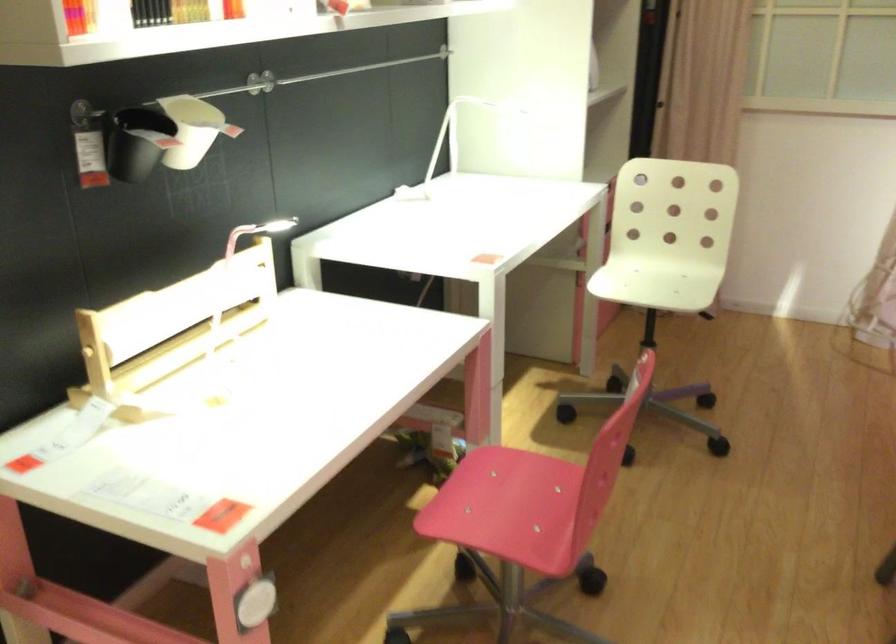
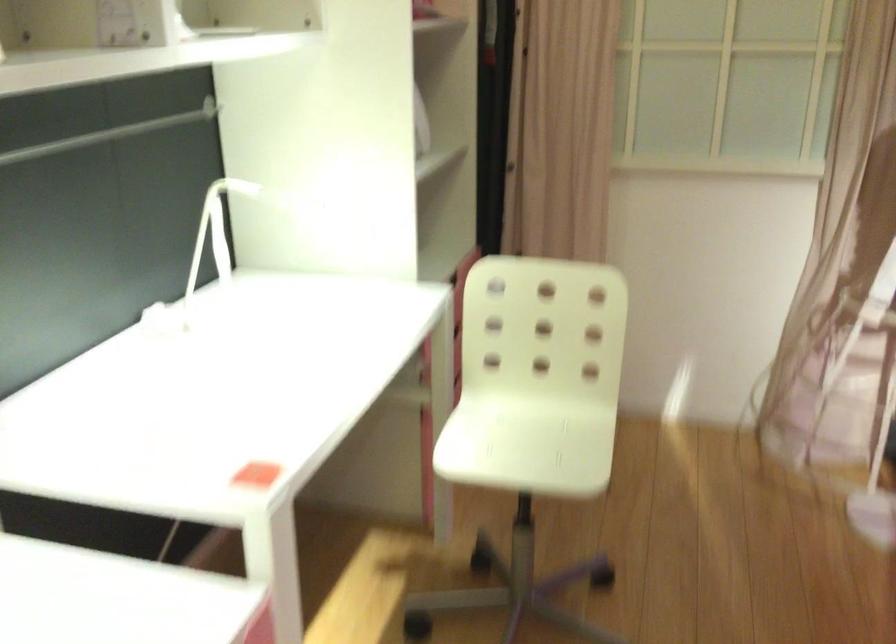
Find the pixel in the second image that matches (x=636, y=279) in the first image.

(495, 431)